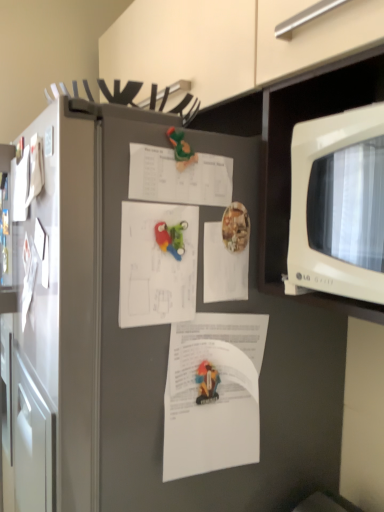
Question: Is rubberized plastic toy at center, placed as the 1th toy when sorted from bottom to top, bigger than white glossy microwave at right?

Choices:
 (A) no
 (B) yes

Answer: (A)

Question: Could you tell me if rubberized plastic toy at center, which ranks as the second toy in top-to-bottom order, is turned towards white glossy microwave at right?

Choices:
 (A) yes
 (B) no

Answer: (B)

Question: Is rubberized plastic toy at center, which ranks as the second toy in top-to-bottom order, next to white glossy microwave at right and touching it?

Choices:
 (A) no
 (B) yes

Answer: (A)

Question: From the image's perspective, is rubberized plastic toy at center, placed as the 1th toy when sorted from bottom to top, on top of white glossy microwave at right?

Choices:
 (A) yes
 (B) no

Answer: (B)

Question: Does rubberized plastic toy at center, which ranks as the second toy in top-to-bottom order, come behind white glossy microwave at right?

Choices:
 (A) yes
 (B) no

Answer: (A)

Question: In the image, is rubberized plastic toy at center, placed as the 1th toy when sorted from bottom to top, on the left side or the right side of white glossy microwave at right?

Choices:
 (A) left
 (B) right

Answer: (A)

Question: Is rubberized plastic toy at center, which ranks as the second toy in top-to-bottom order, bigger or smaller than white glossy microwave at right?

Choices:
 (A) small
 (B) big

Answer: (A)

Question: In terms of width, does rubberized plastic toy at center, placed as the 1th toy when sorted from bottom to top, look wider or thinner when compared to white glossy microwave at right?

Choices:
 (A) thin
 (B) wide

Answer: (A)

Question: Relative to white glossy microwave at right, is rubberized plastic toy at center, placed as the 1th toy when sorted from bottom to top, in front or behind?

Choices:
 (A) behind
 (B) front

Answer: (A)

Question: From the image's perspective, is white paper at center, acting as the 2th document starting from the bottom, positioned above or below green plastic toy at center, the 1th toy when ordered from top to bottom?

Choices:
 (A) above
 (B) below

Answer: (B)

Question: Is white paper at center, positioned as the 3th document in top-to-bottom order, in front of or behind green plastic toy at center, the 2th toy from the bottom, in the image?

Choices:
 (A) behind
 (B) front

Answer: (B)

Question: Considering the relative positions of white paper at center, acting as the 2th document starting from the bottom, and green plastic toy at center, the 1th toy when ordered from top to bottom, in the image provided, is white paper at center, acting as the 2th document starting from the bottom, to the left or to the right of green plastic toy at center, the 1th toy when ordered from top to bottom,?

Choices:
 (A) right
 (B) left

Answer: (B)

Question: Looking at their shapes, would you say white paper at center, positioned as the 3th document in top-to-bottom order, is wider or thinner than green plastic toy at center, the 2th toy from the bottom?

Choices:
 (A) wide
 (B) thin

Answer: (B)

Question: In terms of size, does white paper at center, which is the 3th document in bottom-to-top order, appear bigger or smaller than rubberized plastic toy at center, placed as the 1th toy when sorted from bottom to top?

Choices:
 (A) big
 (B) small

Answer: (A)

Question: Is white paper at center, which is the 3th document in bottom-to-top order, to the left or to the right of rubberized plastic toy at center, placed as the 1th toy when sorted from bottom to top, in the image?

Choices:
 (A) left
 (B) right

Answer: (B)